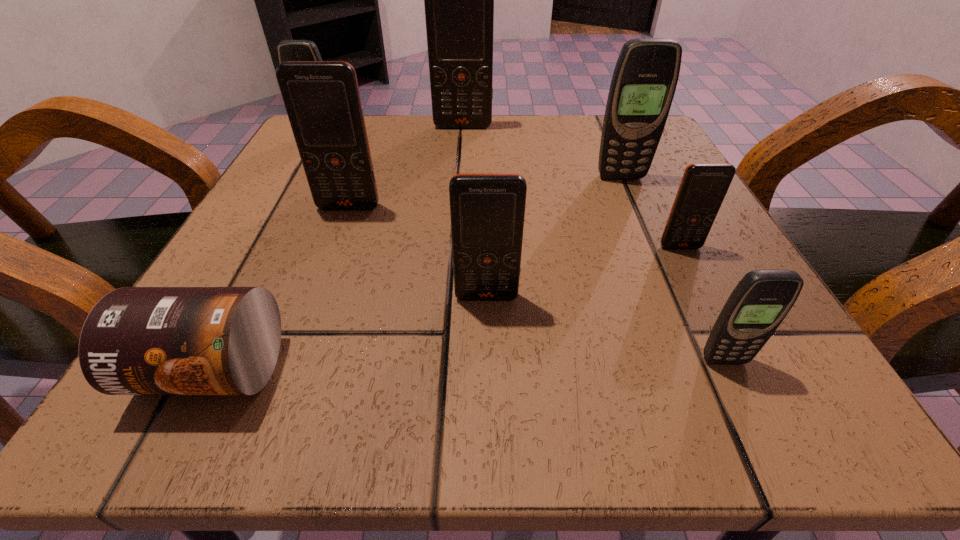
Identify which gray cellular telephone is the closest to the second biggest gray cellular telephone. Please provide its 2D coordinates. Your answer should be formatted as a tuple, i.e. [(x, y)], where the tuple contains the x and y coordinates of a point satisfying the conditions above.

[(645, 77)]

At what (x,y) coordinates should I click in order to perform the action: click on gray cellular telephone that is the third closest one to the sixth farthest cellular telephone. Please return your answer as a coordinate pair (x, y). Image resolution: width=960 pixels, height=540 pixels. Looking at the image, I should click on (288, 50).